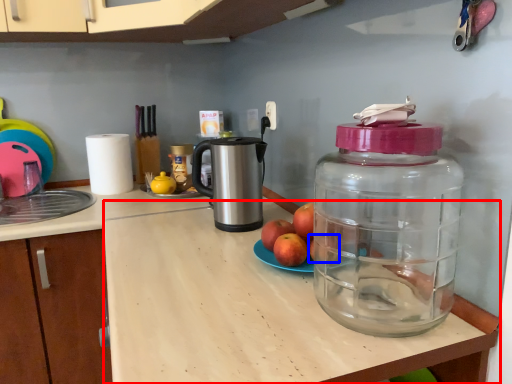
Question: Which point is closer to the camera, counter top (highlighted by a red box) or apple (highlighted by a blue box)?

Choices:
 (A) counter top
 (B) apple

Answer: (A)